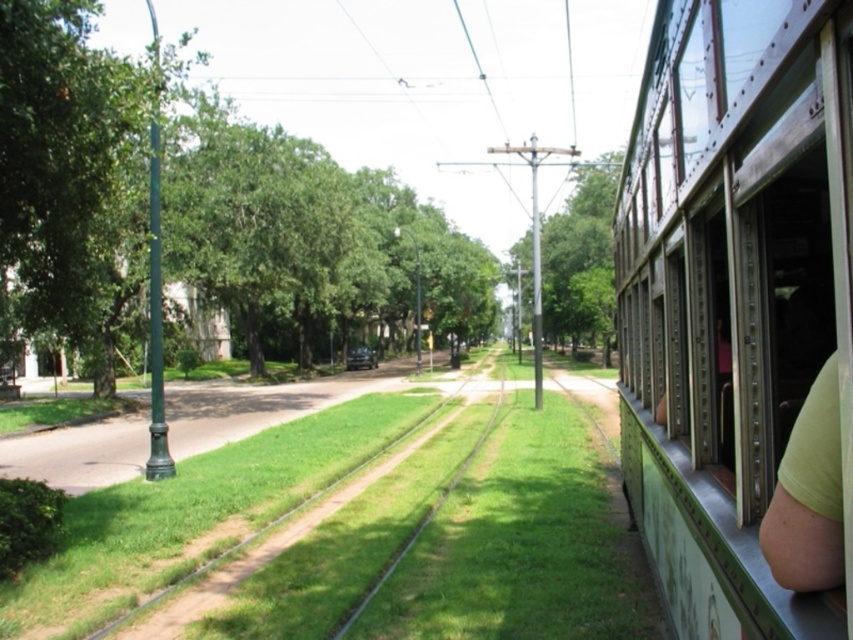
You are standing at the front of the streetcar and looking out the window. There are two points marked on the window. The first point is at coordinate point (770, 129) and the second is at point (773, 529). Which point is closer to you?

Point (773, 529) is closer to you because it is in front of point (770, 129).

Based on the provided coordinates, which object is located at point (730,292) in the image?

The green painted metal train at right is located at point (730,292) in the image.

You are a passenger on the streetcar and want to know if the green painted metal train at right is smaller than the green fabric arm at right. Can you confirm this?

Yes, the green painted metal train at right is smaller in size compared to the green fabric arm at right according to the description.